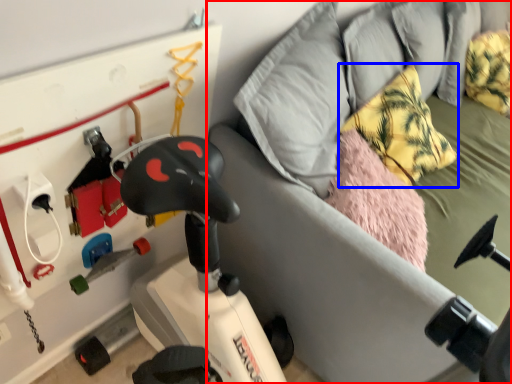
Question: Among these objects, which one is nearest to the camera, furniture (highlighted by a red box) or pillow (highlighted by a blue box)?

Choices:
 (A) furniture
 (B) pillow

Answer: (A)